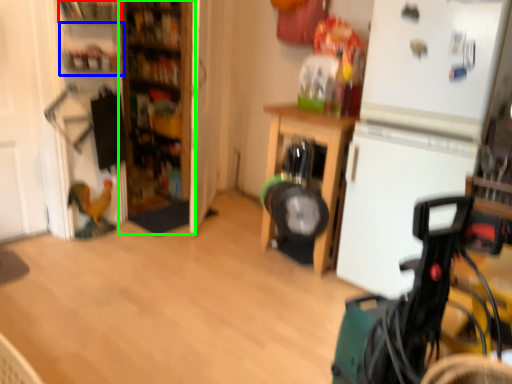
Question: Which object is the closest to the shelf (highlighted by a red box)? Choose among these: shelf (highlighted by a blue box) or bookshelf (highlighted by a green box).

Choices:
 (A) shelf
 (B) bookshelf

Answer: (A)